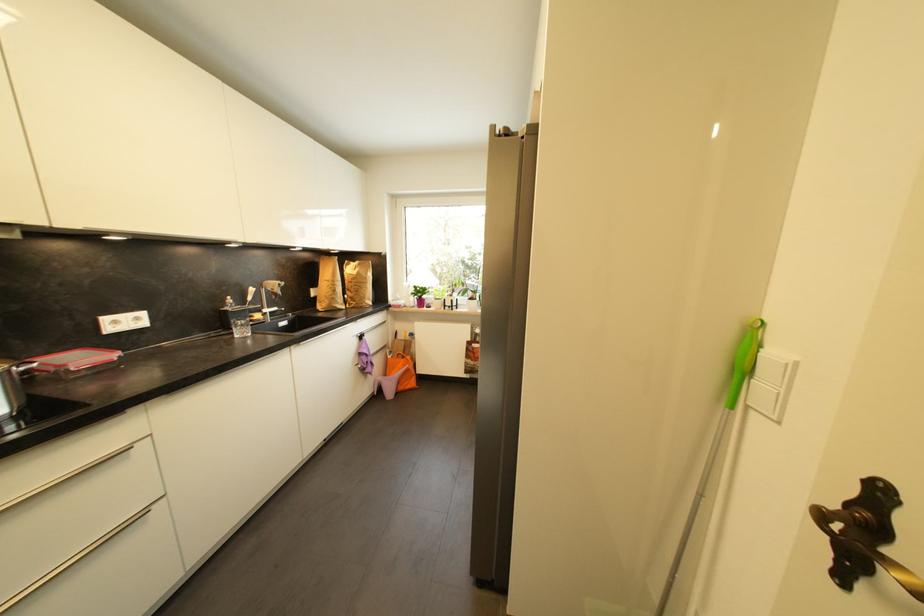
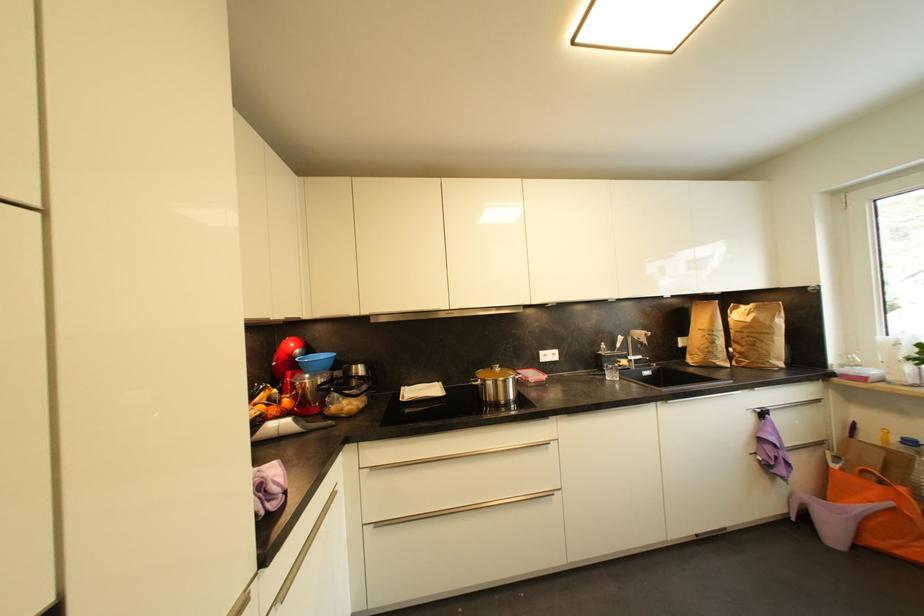
Find the pixel in the second image that matches (x=362, y=334) in the first image.

(760, 408)